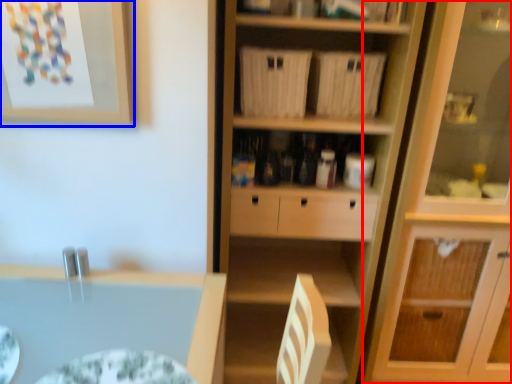
Question: Which point is further to the camera, cabinetry (highlighted by a red box) or picture frame (highlighted by a blue box)?

Choices:
 (A) cabinetry
 (B) picture frame

Answer: (A)